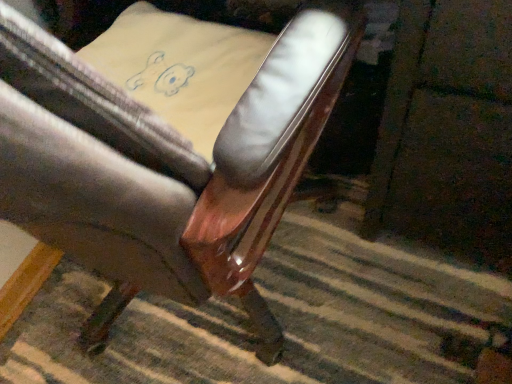
Measure the distance between matte brown chair at center and camera.

They are 8.46 inches apart.

This screenshot has width=512, height=384. I want to click on matte brown chair at center, so click(165, 166).

What do you see at coordinates (165, 166) in the screenshot?
I see `matte brown chair at center` at bounding box center [165, 166].

Find the location of a particular element. The width and height of the screenshot is (512, 384). matte brown chair at center is located at coordinates (165, 166).